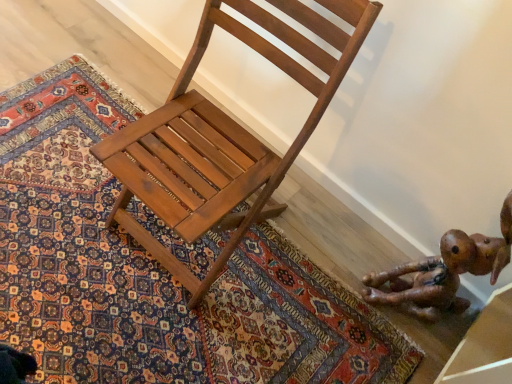
Question: From the image's perspective, is shiny brown wood chair at center positioned above or below carpeted rug at center?

Choices:
 (A) above
 (B) below

Answer: (A)

Question: Considering the positions of shiny brown wood chair at center and carpeted rug at center in the image, is shiny brown wood chair at center wider or thinner than carpeted rug at center?

Choices:
 (A) wide
 (B) thin

Answer: (B)

Question: Which of these objects is positioned farthest from the brown leather toy at lower right?

Choices:
 (A) carpeted rug at center
 (B) shiny brown wood chair at center

Answer: (B)

Question: Considering the real-world distances, which object is closest to the shiny brown wood chair at center?

Choices:
 (A) brown leather toy at lower right
 (B) carpeted rug at center

Answer: (B)